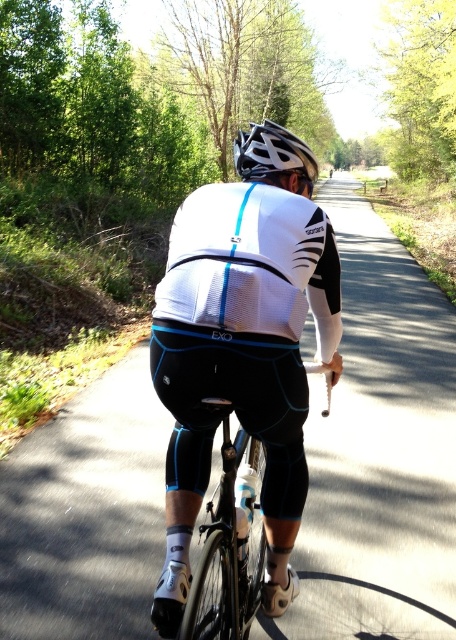
Who is positioned more to the left, white matte cycling jersey at center or black matte bicycle at center?

black matte bicycle at center

Does white matte cycling jersey at center come in front of black matte bicycle at center?

No, white matte cycling jersey at center is behind black matte bicycle at center.

Does point (269, 396) come in front of point (210, 531)?

Yes, it is.

In order to click on white matte cycling jersey at center in this screenshot , I will do `click(243, 344)`.

Which is more to the left, black matte bicycle at center or white matte bicycle helmet at center?

Positioned to the left is black matte bicycle at center.

Between point (234, 476) and point (257, 156), which one is positioned behind?

Positioned behind is point (257, 156).

Between point (228, 435) and point (279, 129), which one is positioned behind?

The point (279, 129) is behind.

The width and height of the screenshot is (456, 640). I want to click on black matte bicycle at center, so click(229, 541).

Who is higher up, white matte cycling jersey at center or white matte bicycle helmet at center?

Positioned higher is white matte bicycle helmet at center.

Is point (284, 481) more distant than point (239, 163)?

No, (284, 481) is in front of (239, 163).

In order to click on white matte cycling jersey at center in this screenshot , I will do `click(243, 344)`.